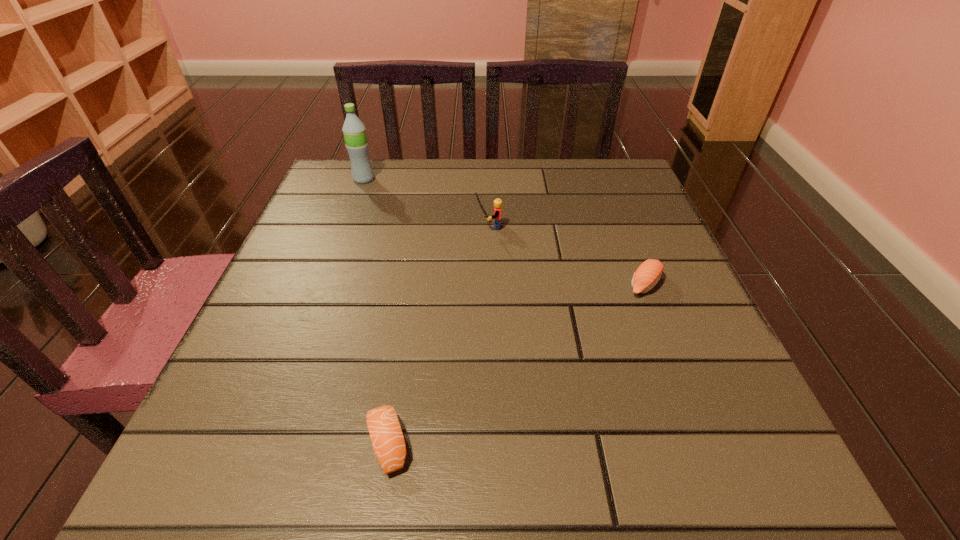
This screenshot has height=540, width=960. In order to click on free space at the left edge of the desktop in this screenshot , I will do `click(300, 315)`.

Locate an element on the screen. The width and height of the screenshot is (960, 540). vacant space at the right edge is located at coordinates (732, 383).

The image size is (960, 540). In the image, there is a desktop. What are the coordinates of `blank space at the far left corner` in the screenshot? It's located at (329, 172).

This screenshot has width=960, height=540. Identify the location of blank space at the near left corner of the desktop. (230, 442).

Where is `free area in between the farthest object and the shorter sushi`? This screenshot has width=960, height=540. free area in between the farthest object and the shorter sushi is located at coordinates (375, 312).

You are a GUI agent. You are given a task and a screenshot of the screen. Output one action in this format:
    pyautogui.click(x=<x>, y=<y>)
    Task: Click on the vacant area between the tallest object and the taller sushi
    The width and height of the screenshot is (960, 540).
    Given the screenshot: What is the action you would take?
    pyautogui.click(x=504, y=232)

Identify the location of free point between the shortest object and the third nearest object. (438, 335).

Locate an element on the screen. Image resolution: width=960 pixels, height=540 pixels. free space between the water bottle and the second object from right to left is located at coordinates (426, 203).

At what (x,y) coordinates should I click in order to perform the action: click on blank region between the taller sushi and the second tallest object. Please return your answer as a coordinate pair (x, y). This screenshot has height=540, width=960. Looking at the image, I should click on (566, 256).

This screenshot has height=540, width=960. I want to click on empty space between the third shortest object and the shortest object, so click(438, 335).